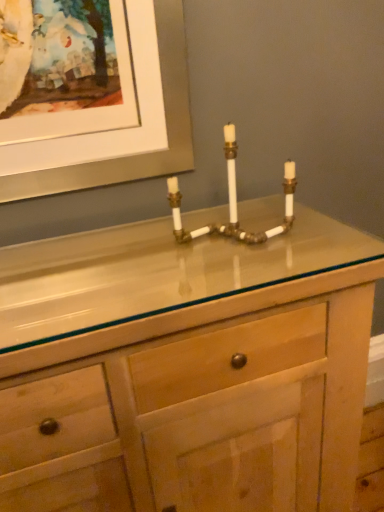
Question: Considering the relative sizes of brass/bronze pipe at center and natural wood cabinet at center in the image provided, is brass/bronze pipe at center wider than natural wood cabinet at center?

Choices:
 (A) yes
 (B) no

Answer: (B)

Question: Considering the relative sizes of brass/bronze pipe at center and natural wood cabinet at center in the image provided, is brass/bronze pipe at center smaller than natural wood cabinet at center?

Choices:
 (A) no
 (B) yes

Answer: (B)

Question: Does brass/bronze pipe at center have a lesser width compared to natural wood cabinet at center?

Choices:
 (A) yes
 (B) no

Answer: (A)

Question: Would you consider brass/bronze pipe at center to be distant from natural wood cabinet at center?

Choices:
 (A) no
 (B) yes

Answer: (A)

Question: Is brass/bronze pipe at center behind natural wood cabinet at center?

Choices:
 (A) yes
 (B) no

Answer: (A)

Question: From the image's perspective, does brass/bronze pipe at center appear lower than natural wood cabinet at center?

Choices:
 (A) yes
 (B) no

Answer: (B)

Question: Is natural wood cabinet at center completely or partially outside of brass/bronze pipe at center?

Choices:
 (A) no
 (B) yes

Answer: (B)

Question: From the image's perspective, would you say natural wood cabinet at center is shown under brass/bronze pipe at center?

Choices:
 (A) yes
 (B) no

Answer: (A)

Question: Can you confirm if natural wood cabinet at center is bigger than brass/bronze pipe at center?

Choices:
 (A) no
 (B) yes

Answer: (B)

Question: From a real-world perspective, is natural wood cabinet at center on brass/bronze pipe at center?

Choices:
 (A) yes
 (B) no

Answer: (B)

Question: Does natural wood cabinet at center have a lesser height compared to brass/bronze pipe at center?

Choices:
 (A) no
 (B) yes

Answer: (A)

Question: Considering the relative sizes of natural wood cabinet at center and brass/bronze pipe at center in the image provided, is natural wood cabinet at center wider than brass/bronze pipe at center?

Choices:
 (A) yes
 (B) no

Answer: (A)

Question: Looking at their shapes, would you say natural wood cabinet at center is wider or thinner than brass/bronze pipe at center?

Choices:
 (A) thin
 (B) wide

Answer: (B)